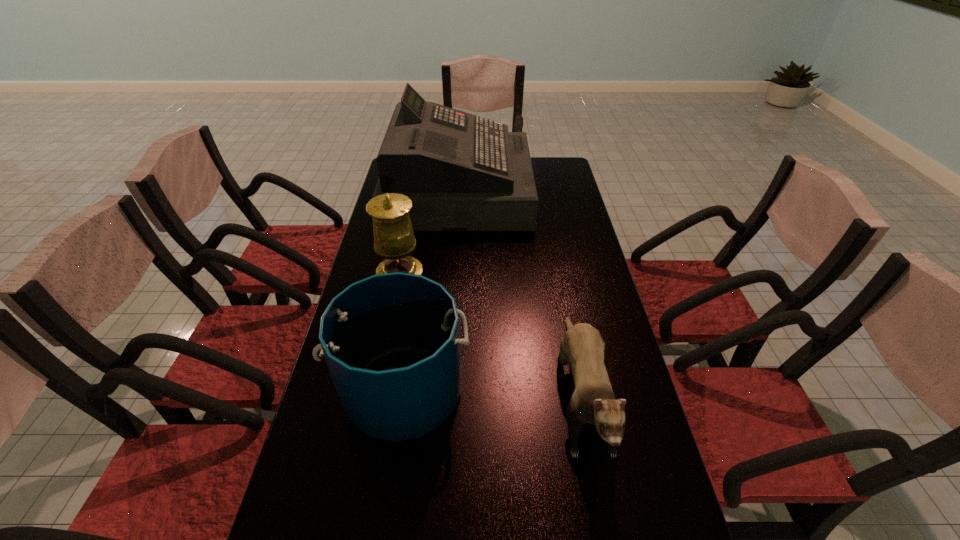
The height and width of the screenshot is (540, 960). In order to click on the third closest object to the farthest object in this screenshot , I will do `click(391, 341)`.

Locate an element on the screen. vacant space that satisfies the following two spatial constraints: 1. on the front-facing side of the farthest object; 2. on the front side of the bucket is located at coordinates (445, 391).

Where is `free space that satisfies the following two spatial constraints: 1. on the front-facing side of the farthest object; 2. on the front side of the bucket`? This screenshot has width=960, height=540. free space that satisfies the following two spatial constraints: 1. on the front-facing side of the farthest object; 2. on the front side of the bucket is located at coordinates (445, 391).